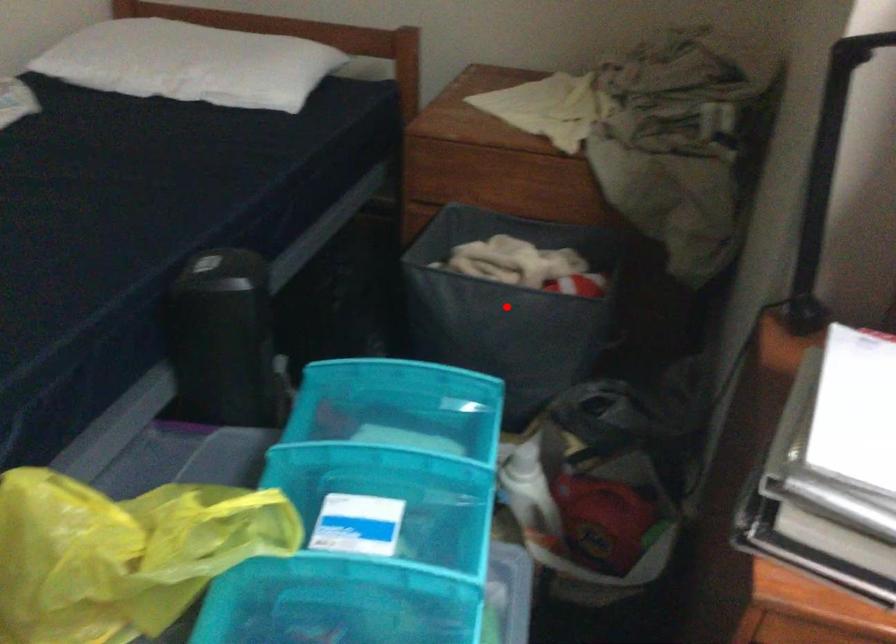
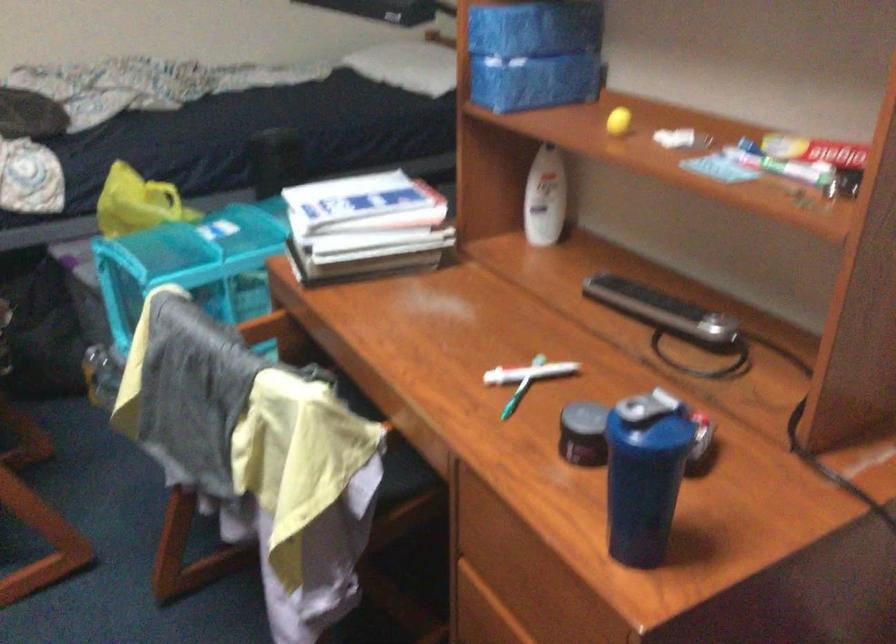
Question: I am providing you with two images of the same scene from different viewpoints. A red point is marked on the first image. Can you still see the location of the red point in image 2?

Choices:
 (A) Yes
 (B) No

Answer: (B)